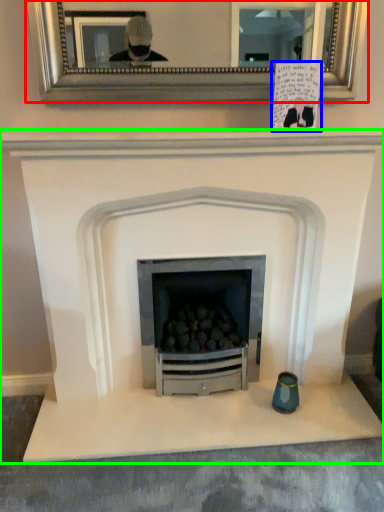
Question: Estimate the real-world distances between objects in this image. Which object is closer to picture frame (highlighted by a red box), postcard (highlighted by a blue box) or fireplace (highlighted by a green box)?

Choices:
 (A) postcard
 (B) fireplace

Answer: (A)